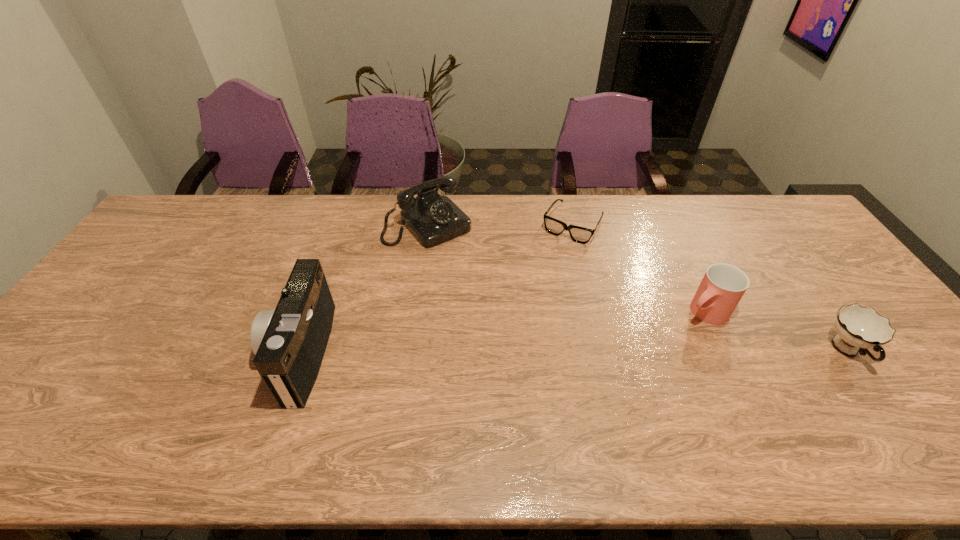
Locate which object is the fourth closest to the telephone. Please provide its 2D coordinates. Your answer should be formatted as a tuple, i.e. [(x, y)], where the tuple contains the x and y coordinates of a point satisfying the conditions above.

[(859, 328)]

Choose which object is the third nearest neighbor to the left cup. Please provide its 2D coordinates. Your answer should be formatted as a tuple, i.e. [(x, y)], where the tuple contains the x and y coordinates of a point satisfying the conditions above.

[(433, 219)]